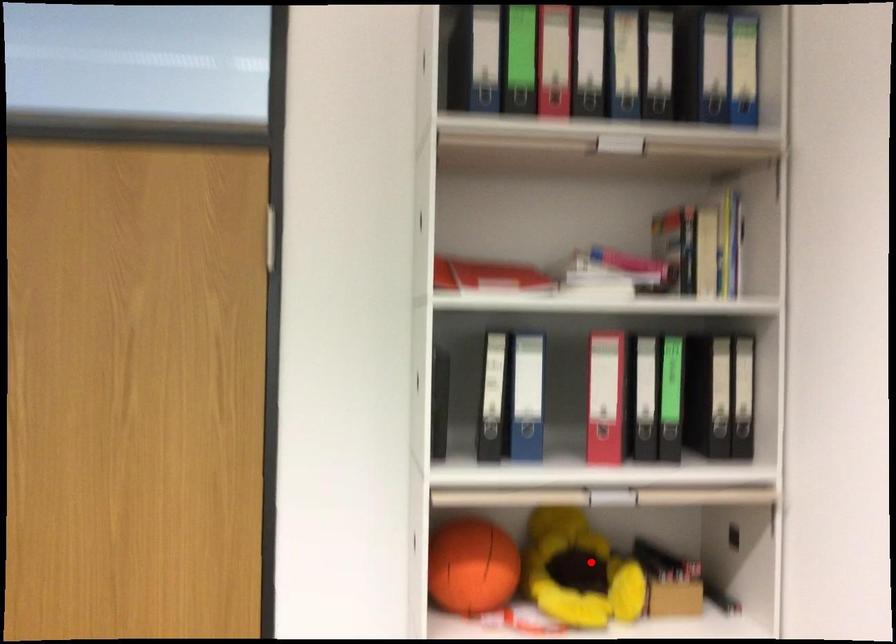
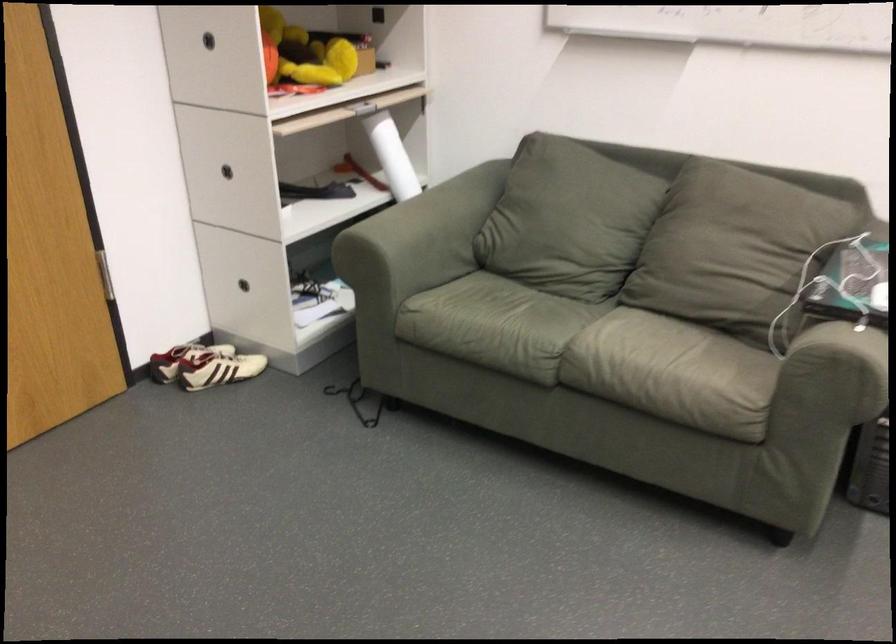
Question: I am providing you with two images of the same scene from different viewpoints. A red point is marked on the first image. At the location where the point appears in image 1, is it still visible in image 2?

Choices:
 (A) Yes
 (B) No

Answer: (A)